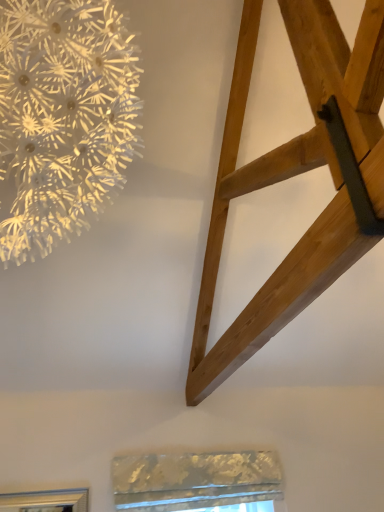
Question: From the image's perspective, is natural wood ladder at upper right on top of white textured paper flower at upper left?

Choices:
 (A) no
 (B) yes

Answer: (A)

Question: From the image's perspective, is natural wood ladder at upper right located beneath white textured paper flower at upper left?

Choices:
 (A) yes
 (B) no

Answer: (A)

Question: From a real-world perspective, is natural wood ladder at upper right beneath white textured paper flower at upper left?

Choices:
 (A) yes
 (B) no

Answer: (B)

Question: Is natural wood ladder at upper right taller than white textured paper flower at upper left?

Choices:
 (A) no
 (B) yes

Answer: (A)

Question: Can you see natural wood ladder at upper right touching white textured paper flower at upper left?

Choices:
 (A) no
 (B) yes

Answer: (A)

Question: Considering the positions of point (119, 461) and point (256, 162), is point (119, 461) closer or farther from the camera than point (256, 162)?

Choices:
 (A) farther
 (B) closer

Answer: (A)

Question: Is metallic textured window at lower center in front of or behind natural wood ladder at upper right in the image?

Choices:
 (A) behind
 (B) front

Answer: (A)

Question: Is metallic textured window at lower center wider or thinner than natural wood ladder at upper right?

Choices:
 (A) wide
 (B) thin

Answer: (B)

Question: From a real-world perspective, is metallic textured window at lower center physically located above or below natural wood ladder at upper right?

Choices:
 (A) above
 (B) below

Answer: (B)

Question: From a real-world perspective, relative to white textured paper flower at upper left, is natural wood ladder at upper right vertically above or below?

Choices:
 (A) above
 (B) below

Answer: (A)

Question: Do you think natural wood ladder at upper right is within white textured paper flower at upper left, or outside of it?

Choices:
 (A) outside
 (B) inside

Answer: (A)

Question: In terms of width, does natural wood ladder at upper right look wider or thinner when compared to white textured paper flower at upper left?

Choices:
 (A) thin
 (B) wide

Answer: (B)

Question: Does point (354, 77) appear closer or farther from the camera than point (56, 120)?

Choices:
 (A) closer
 (B) farther

Answer: (B)

Question: Considering the positions of metallic textured window at lower center and white textured paper flower at upper left in the image, is metallic textured window at lower center wider or thinner than white textured paper flower at upper left?

Choices:
 (A) wide
 (B) thin

Answer: (B)

Question: Is point (137, 466) closer or farther from the camera than point (36, 89)?

Choices:
 (A) closer
 (B) farther

Answer: (B)